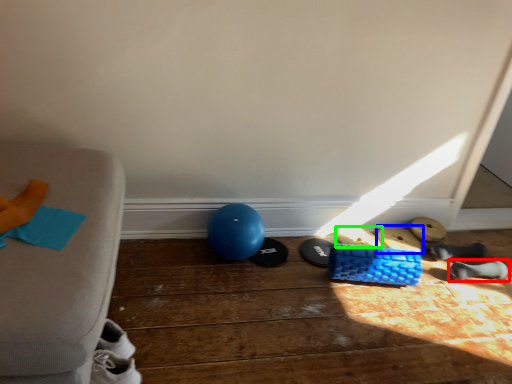
Question: Which is nearer to the footwear (highlighted by a red box)? footwear (highlighted by a blue box) or footwear (highlighted by a green box).

Choices:
 (A) footwear
 (B) footwear

Answer: (A)